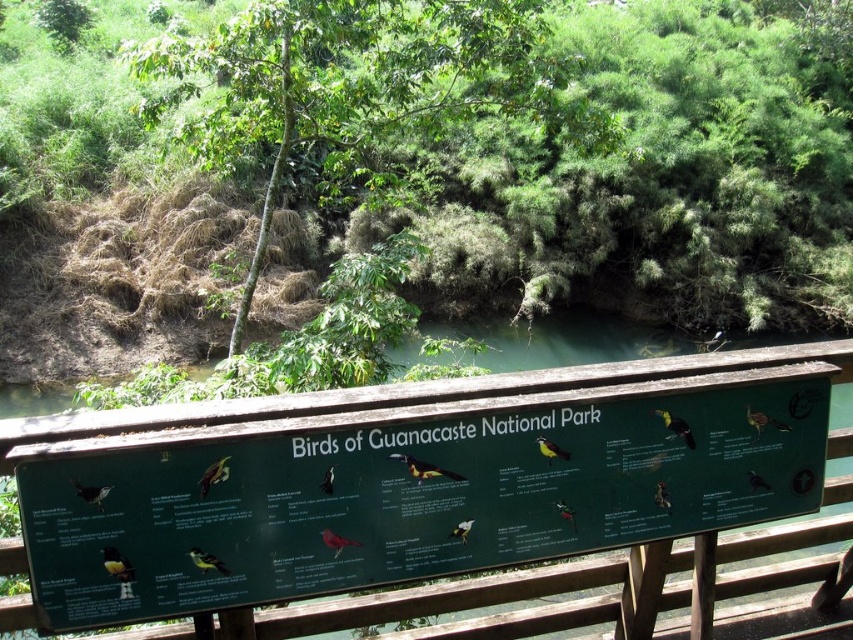
Question: Does green matte signboard at center appear under green leafy tree at upper center?

Choices:
 (A) no
 (B) yes

Answer: (B)

Question: Is green matte signboard at center below green leafy tree at upper center?

Choices:
 (A) yes
 (B) no

Answer: (A)

Question: Is green matte signboard at center to the left of green leafy tree at upper center from the viewer's perspective?

Choices:
 (A) yes
 (B) no

Answer: (B)

Question: Which of the following is the farthest from the observer?

Choices:
 (A) green leafy tree at upper center
 (B) green matte signboard at center

Answer: (A)